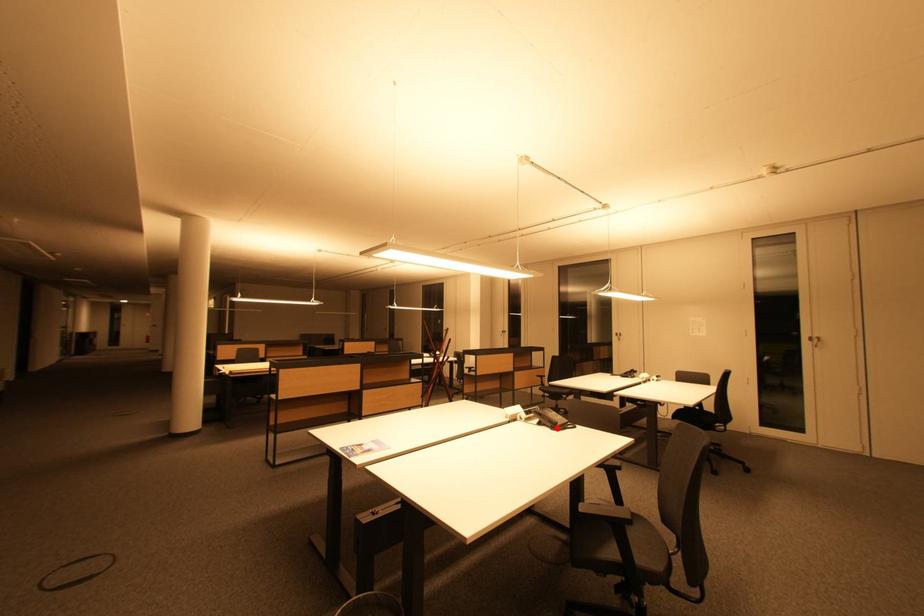
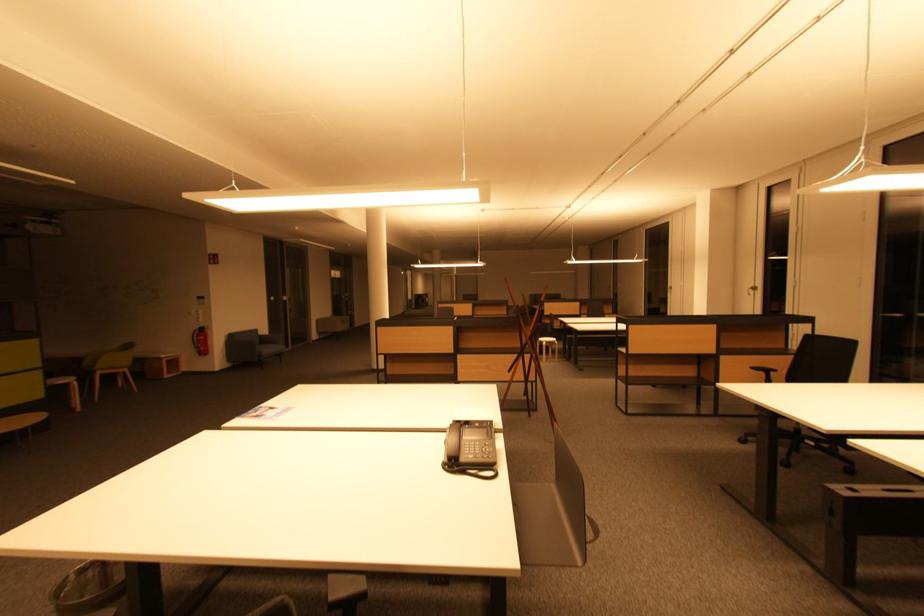
In the second image, find the point that corresponds to the highlighted location in the first image.

(450, 463)